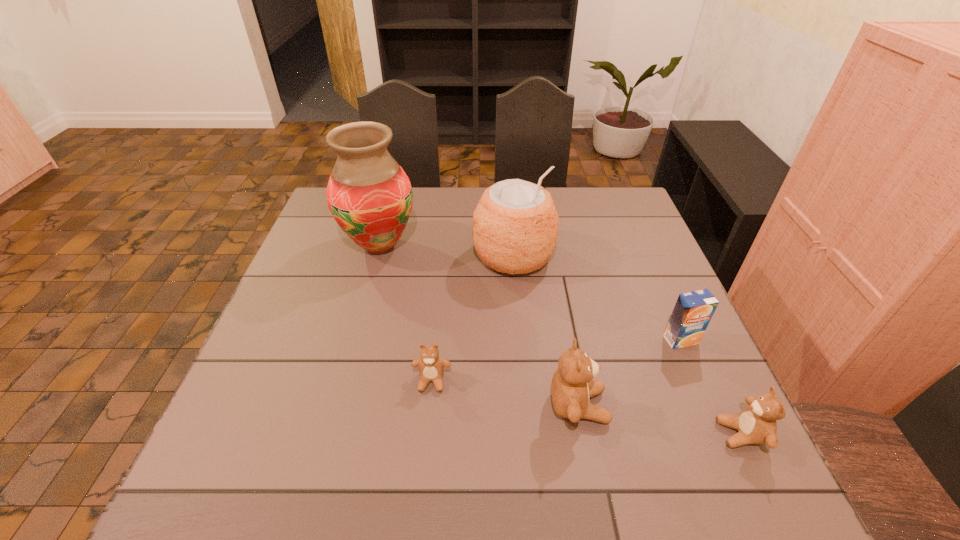
In the current image, all teddy bears are evenly spaced. To maintain this equal spacing, where should an additional teddy bear be placed on the left? Please point out a free spot. Please provide its 2D coordinates. Your answer should be formatted as a tuple, i.e. [(x, y)], where the tuple contains the x and y coordinates of a point satisfying the conditions above.

[(299, 357)]